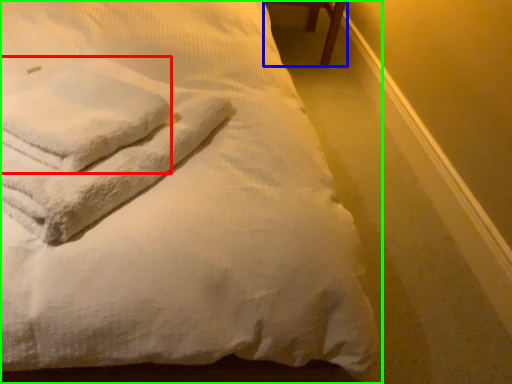
Question: Which object is positioned closest to bath towel (highlighted by a red box)? Select from furniture (highlighted by a blue box) and bed (highlighted by a green box).

Choices:
 (A) furniture
 (B) bed

Answer: (B)